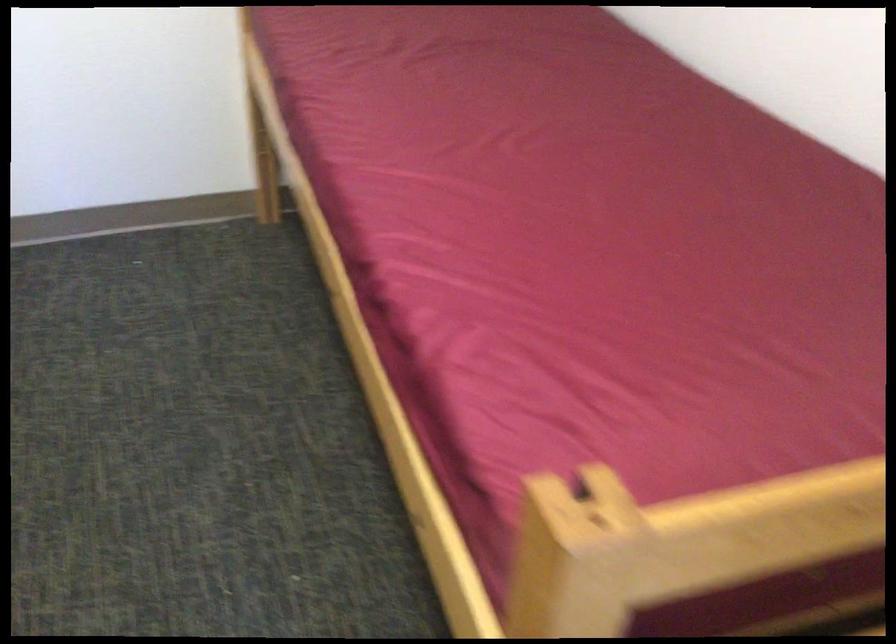
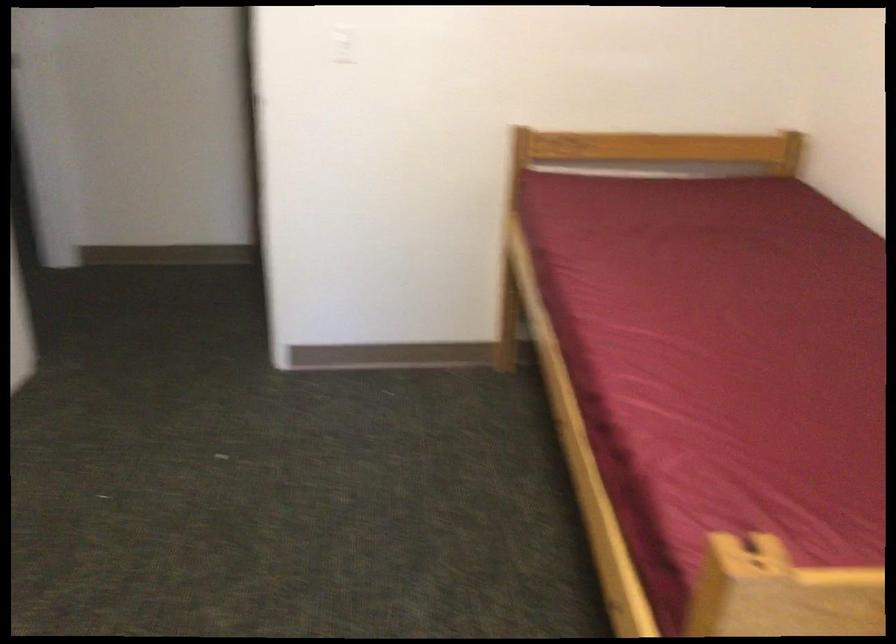
In the second image, find the point that corresponds to point 504,190 in the first image.

(719, 348)